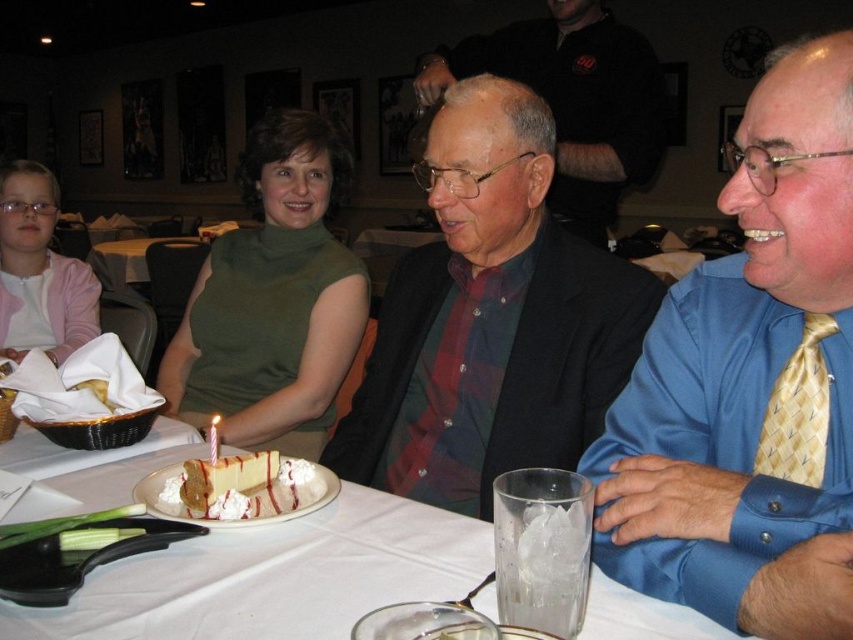
You are a photographer trying to capture a closeup of the white paper birthday candle at center. You need to ensure that the matte black jacket at center does not block the candle. Based on the scene description, can you determine if the candle will be visible in the photo?

The matte black jacket at center is bigger than the white paper birthday candle at center, so the candle might be partially or fully blocked by the jacket depending on their exact positions. However, since both are at the center, adjusting the camera angle slightly could help ensure the candle remains visible.

You are standing at the edge of the table in the restaurant scene. You see a point marked at coordinates [750,385]. Which object is this point located on?

The point at coordinates [750,385] is located on the blue satin shirt at center.

You are a photographer standing at the edge of the table. You want to take a photo of the pink fleece jacket at upper left and the person sitting next to them. How far apart are they?

The pink fleece jacket at upper left and the person sitting next to them are 6.64 feet apart.